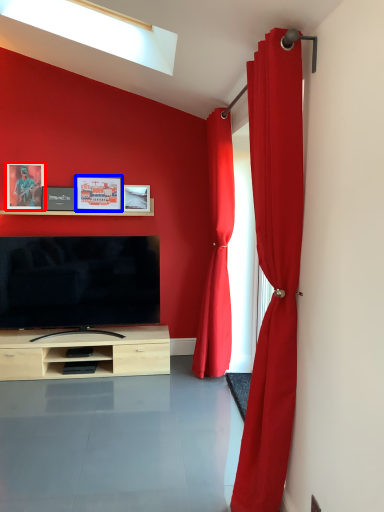
Question: Which object appears farthest to the camera in this image, picture frame (highlighted by a red box) or picture frame (highlighted by a blue box)?

Choices:
 (A) picture frame
 (B) picture frame

Answer: (B)